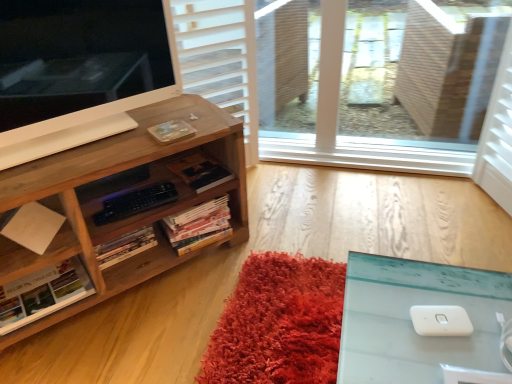
Question: Is hardcover book at center, the first book from the right, inside white paper at left, the fourth book positioned from the right?

Choices:
 (A) yes
 (B) no

Answer: (B)

Question: From a real-world perspective, is white paper at left, the first book positioned from the left, positioned over hardcover book at center, the fourth book positioned from the left, based on gravity?

Choices:
 (A) no
 (B) yes

Answer: (A)

Question: Can you confirm if white paper at left, the fourth book positioned from the right, is thinner than hardcover book at center, the first book from the right?

Choices:
 (A) no
 (B) yes

Answer: (A)

Question: Does white paper at left, the fourth book positioned from the right, turn towards hardcover book at center, the fourth book positioned from the left?

Choices:
 (A) no
 (B) yes

Answer: (A)

Question: From the image's perspective, is white paper at left, the fourth book positioned from the right, on hardcover book at center, the first book from the right?

Choices:
 (A) yes
 (B) no

Answer: (B)

Question: Considering the relative sizes of white paper at left, the fourth book positioned from the right, and hardcover book at center, the first book from the right, in the image provided, is white paper at left, the fourth book positioned from the right, shorter than hardcover book at center, the first book from the right,?

Choices:
 (A) no
 (B) yes

Answer: (A)

Question: Is white glossy computer monitor at upper left at the right side of white matte paper at lower left?

Choices:
 (A) no
 (B) yes

Answer: (B)

Question: Is white glossy computer monitor at upper left smaller than white matte paper at lower left?

Choices:
 (A) no
 (B) yes

Answer: (A)

Question: Can you confirm if white glossy computer monitor at upper left is taller than white matte paper at lower left?

Choices:
 (A) yes
 (B) no

Answer: (A)

Question: Is white glossy computer monitor at upper left positioned far away from white matte paper at lower left?

Choices:
 (A) yes
 (B) no

Answer: (B)

Question: From the image's perspective, would you say white glossy computer monitor at upper left is shown under white matte paper at lower left?

Choices:
 (A) no
 (B) yes

Answer: (A)

Question: Does white glossy computer monitor at upper left turn towards white matte paper at lower left?

Choices:
 (A) no
 (B) yes

Answer: (A)

Question: From the image's perspective, is hardcover book at center, positioned as the 2th book in left-to-right order, located beneath hardcover book at center, the fourth book positioned from the left?

Choices:
 (A) yes
 (B) no

Answer: (A)